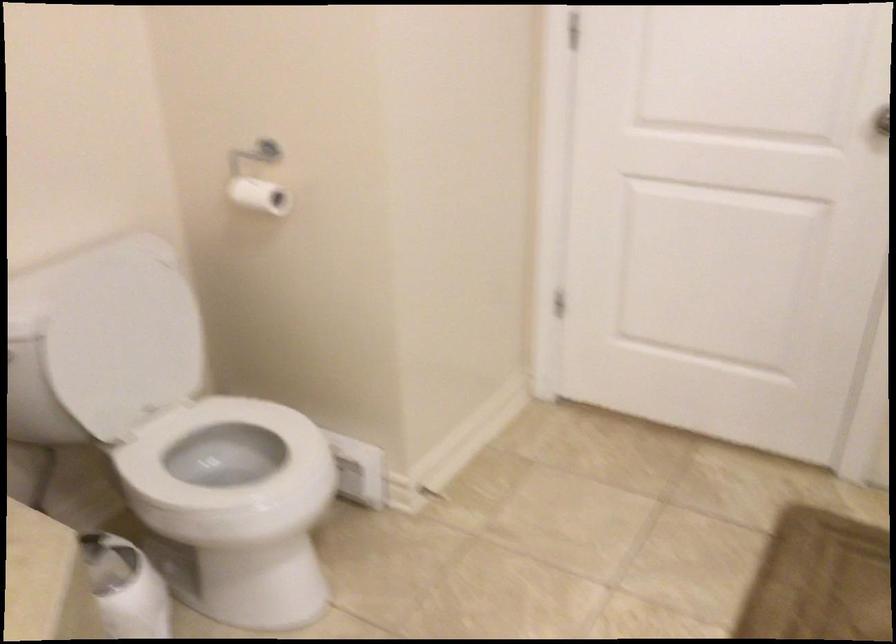
Where would you lift the white toilet seat? Please return your answer as a coordinate pair (x, y).

(226, 453)